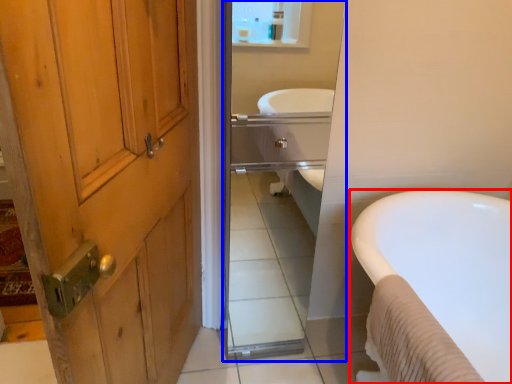
Question: Which of the following is the farthest to the observer, bathtub (highlighted by a red box) or mirror (highlighted by a blue box)?

Choices:
 (A) bathtub
 (B) mirror

Answer: (B)